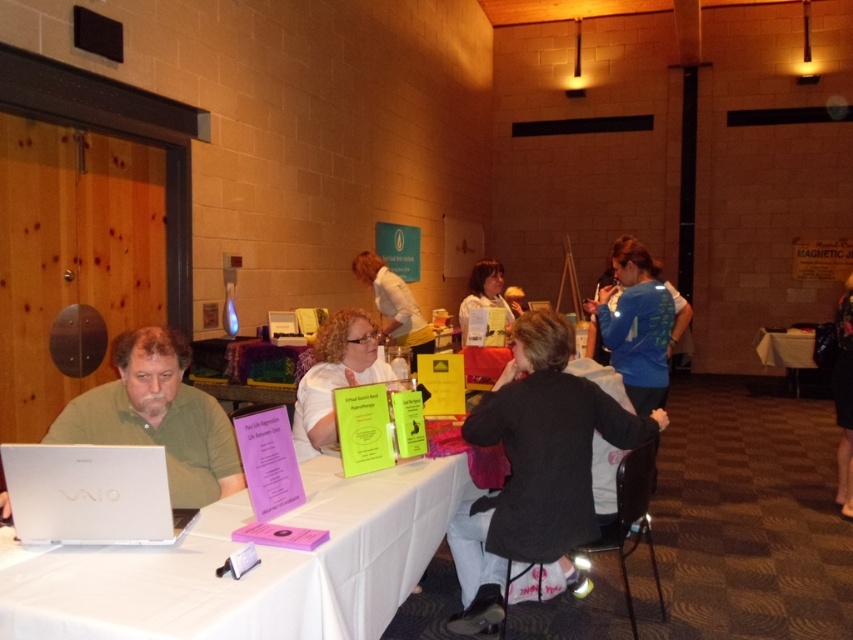
You are organizing a tech workshop and need to place a VAIO laptop on the table. The laptop must be positioned exactly at the coordinates provided in the scene description. Where should you place the green matte laptop at left?

You should place the green matte laptop at left at the coordinates point (158, 417) as specified in the scene description.

You are organizing a workshop and need to place a name tag on the table. The name tag is the same width as the white smooth shirt at center. Will it fit next to the silver metallic laptop at left without overlapping?

The silver metallic laptop at left has a lesser width compared to the white smooth shirt at center. Since the name tag is as wide as the shirt, it will not fit next to the laptop without overlapping because the laptop is narrower than the shirt, and thus the name tag would require more space than available.